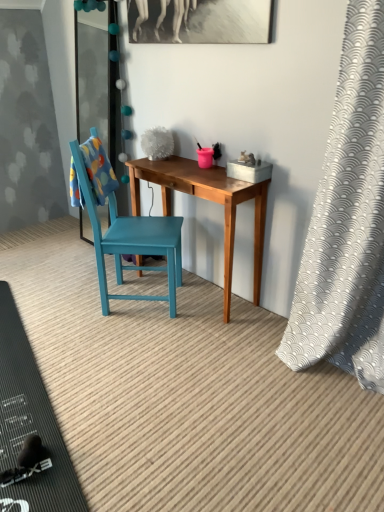
Where is `vacant space that's between white textured curtain at right and wooden desk at center`? Image resolution: width=384 pixels, height=512 pixels. vacant space that's between white textured curtain at right and wooden desk at center is located at coordinates pos(256,328).